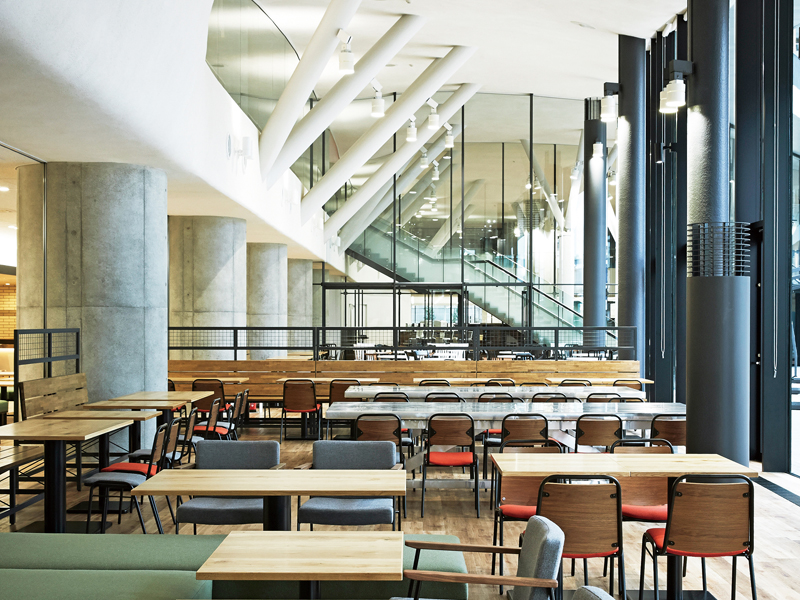
Where is `pillars`? The image size is (800, 600). pillars is located at coordinates (101, 296), (197, 271), (262, 290), (306, 283), (592, 165), (637, 159), (700, 121).